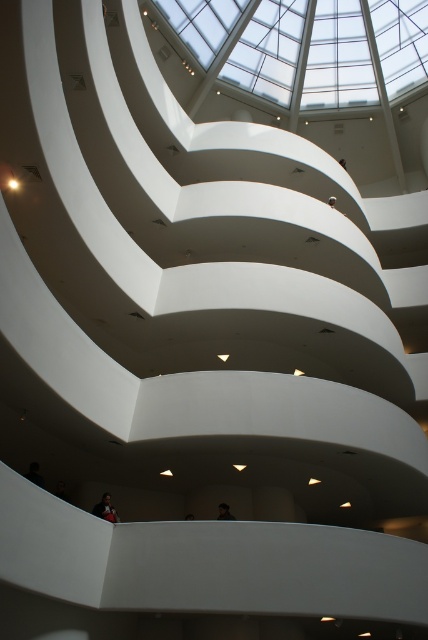
You are standing at the bottom of the spiral staircase in the Guggenheim Museum. You notice two points marked on the walls. The first point is at coordinate point (x=101, y=506) and the second is at point (x=222, y=508). Which point is closer to you?

Point (x=101, y=506) is closer to the viewer than point (x=222, y=508).

You are standing at the bottom of the spiral staircase in the Guggenheim Museum and see the dark brown leather jacket at lower center. If you want to reach the jacket, in which direction should you move relative to the staircase structure?

The dark brown leather jacket at lower center is located at point coordinates of (106, 508), so you should move towards the lower center direction relative to the staircase structure to reach it.